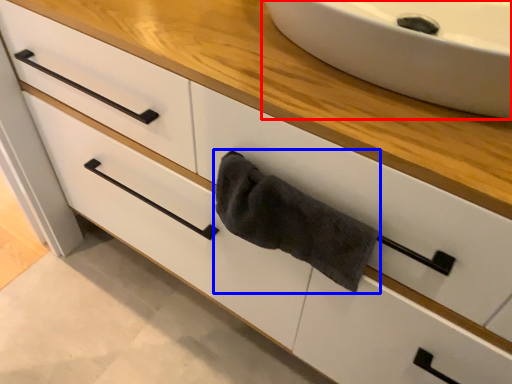
Question: Which point is further to the camera, sink (highlighted by a red box) or bath towel (highlighted by a blue box)?

Choices:
 (A) sink
 (B) bath towel

Answer: (B)